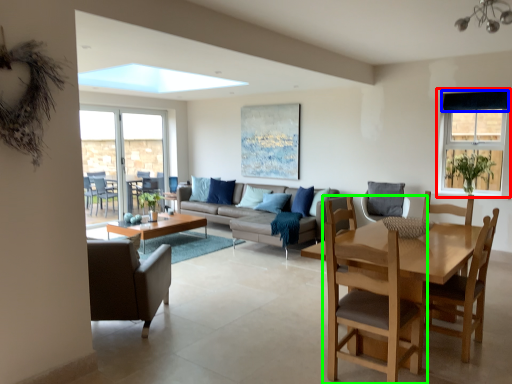
Question: Considering the real-world distances, which object is farthest from window (highlighted by a red box)? curtain (highlighted by a blue box) or chair (highlighted by a green box)?

Choices:
 (A) curtain
 (B) chair

Answer: (B)